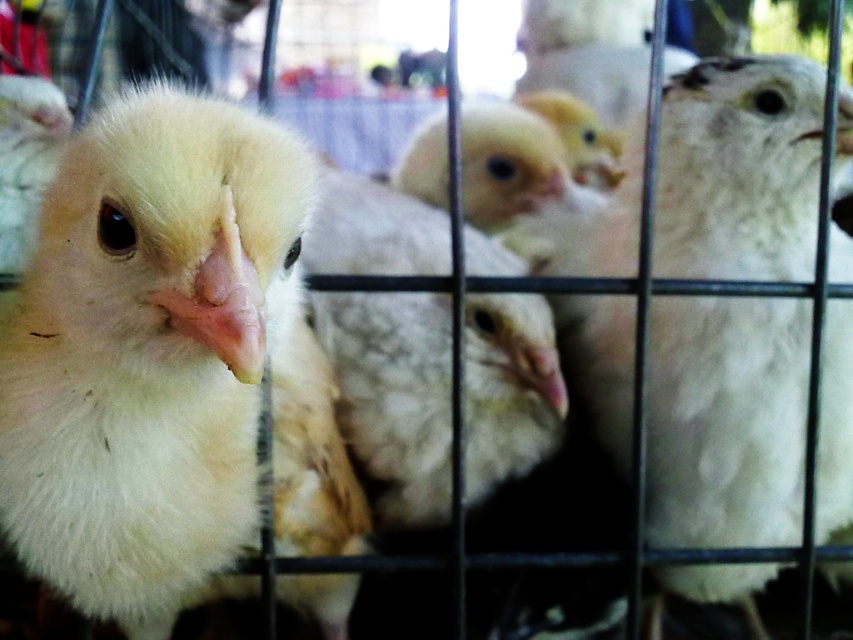
Is fluffy white chick at center taller than white fluffy chick at center?

Correct, fluffy white chick at center is much taller as white fluffy chick at center.

Can you confirm if fluffy white chick at center is shorter than white fluffy chick at center?

No, fluffy white chick at center is not shorter than white fluffy chick at center.

Find the location of `fluffy white chick at center`. fluffy white chick at center is located at coordinates (167, 364).

Locate an element on the screen. This screenshot has width=853, height=640. fluffy white chick at center is located at coordinates (167, 364).